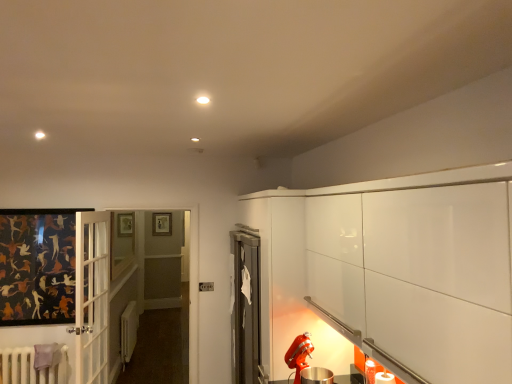
Question: Is white painted radiator at lower left, arranged as the 1th radiator when viewed from the front, surrounding clear glass window at center?

Choices:
 (A) yes
 (B) no

Answer: (B)

Question: Does white painted radiator at lower left, arranged as the 1th radiator when viewed from the front, lie behind clear glass window at center?

Choices:
 (A) no
 (B) yes

Answer: (A)

Question: From a real-world perspective, does white painted radiator at lower left, arranged as the 1th radiator when viewed from the front, stand above clear glass window at center?

Choices:
 (A) no
 (B) yes

Answer: (A)

Question: Is white painted radiator at lower left, the 2th radiator from the back, not near clear glass window at center?

Choices:
 (A) no
 (B) yes

Answer: (B)

Question: Is clear glass window at center at the back of white painted radiator at lower left, the 2th radiator from the back?

Choices:
 (A) no
 (B) yes

Answer: (A)

Question: From a real-world perspective, relative to white painted radiator at lower left, the 2th radiator from the back, is white matte radiator at lower left, the first radiator positioned from the back, vertically above or below?

Choices:
 (A) below
 (B) above

Answer: (A)

Question: Is white matte radiator at lower left, marked as the 2th radiator in a front-to-back arrangement, taller or shorter than white painted radiator at lower left, the 2th radiator from the back?

Choices:
 (A) tall
 (B) short

Answer: (A)

Question: Is point (135, 342) positioned closer to the camera than point (3, 359)?

Choices:
 (A) closer
 (B) farther

Answer: (B)

Question: From the image's perspective, relative to white painted radiator at lower left, arranged as the 1th radiator when viewed from the front, is white matte radiator at lower left, the first radiator positioned from the back, above or below?

Choices:
 (A) above
 (B) below

Answer: (B)

Question: Considering their positions, is wooden picture frame at upper center located in front of or behind white matte radiator at lower left, the first radiator positioned from the back?

Choices:
 (A) behind
 (B) front

Answer: (A)

Question: Is wooden picture frame at upper center inside or outside of white matte radiator at lower left, marked as the 2th radiator in a front-to-back arrangement?

Choices:
 (A) outside
 (B) inside

Answer: (A)

Question: From a real-world perspective, relative to white matte radiator at lower left, marked as the 2th radiator in a front-to-back arrangement, is wooden picture frame at upper center vertically above or below?

Choices:
 (A) below
 (B) above

Answer: (B)

Question: Does point (169, 221) appear closer or farther from the camera than point (122, 357)?

Choices:
 (A) farther
 (B) closer

Answer: (A)

Question: From the image's perspective, relative to clear glass window at center, is white matte radiator at lower left, marked as the 2th radiator in a front-to-back arrangement, above or below?

Choices:
 (A) below
 (B) above

Answer: (A)

Question: Considering the positions of point (135, 314) and point (129, 218), is point (135, 314) closer or farther from the camera than point (129, 218)?

Choices:
 (A) farther
 (B) closer

Answer: (B)